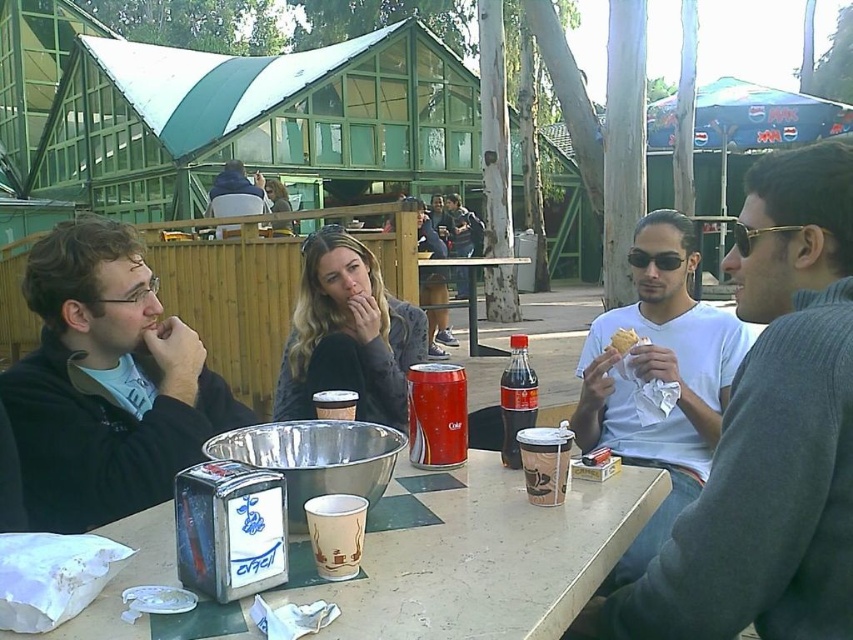
Question: Observing the image, what is the correct spatial positioning of gray sweater at right in reference to golden flaky pastry at right?

Choices:
 (A) below
 (B) above

Answer: (A)

Question: Can you confirm if black matte jacket at left is positioned above matte plastic cup at table center?

Choices:
 (A) no
 (B) yes

Answer: (B)

Question: Is black matte jacket at left closer to the viewer compared to golden flaky pastry at right?

Choices:
 (A) yes
 (B) no

Answer: (A)

Question: Which of the following is the farthest from the observer?

Choices:
 (A) (341, 412)
 (B) (442, 369)
 (C) (664, 538)

Answer: (C)

Question: Among these points, which one is farthest from the camera?

Choices:
 (A) (669, 260)
 (B) (815, 298)
 (C) (132, 387)
 (D) (212, 212)

Answer: (D)

Question: Based on their relative distances, which object is nearer to the gray sweater at right?

Choices:
 (A) shiny red can at center
 (B) black plastic sunglasses at center
 (C) dark red plastic bottle at center

Answer: (C)